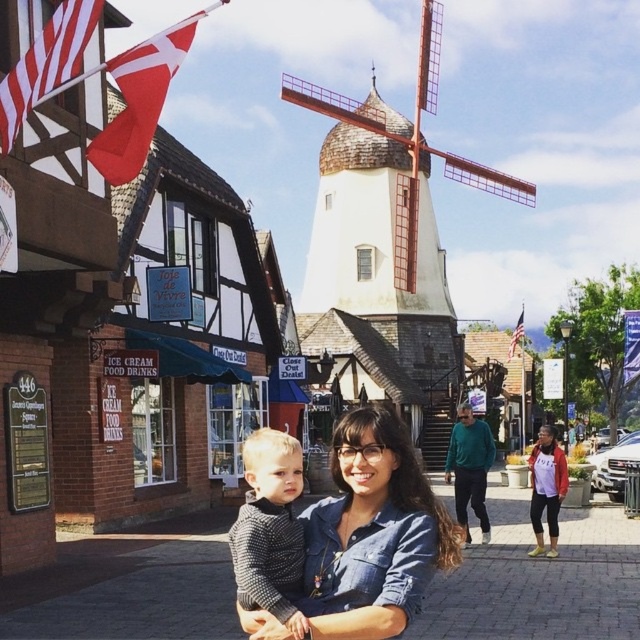
Question: Does red fabric flag at upper left come in front of american flag at upper center?

Choices:
 (A) no
 (B) yes

Answer: (B)

Question: Which object is positioned farthest from the american flag at upper center?

Choices:
 (A) red fabric flag at upper left
 (B) red and white striped flag at upper left

Answer: (B)

Question: Is denim shirt at center wider than red and white striped flag at upper left?

Choices:
 (A) yes
 (B) no

Answer: (A)

Question: Among these points, which one is farthest from the camera?

Choices:
 (A) (172, 40)
 (B) (445, 177)
 (C) (337, 586)

Answer: (B)

Question: Does knitted sweater at center appear under red and white striped flag at upper left?

Choices:
 (A) no
 (B) yes

Answer: (B)

Question: Which point is farther from the camera taking this photo?

Choices:
 (A) (273, 538)
 (B) (406, 250)

Answer: (B)